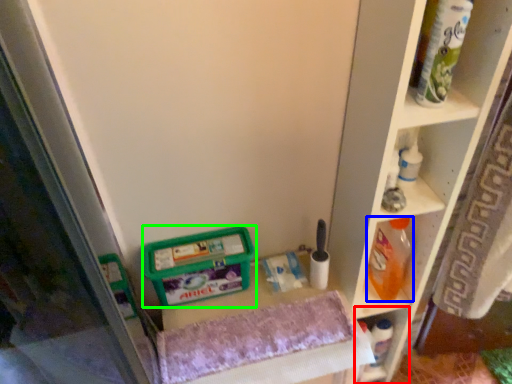
Question: Considering the real-world distances, which object is closest to shelf (highlighted by a red box)? cleaning product (highlighted by a blue box) or wide (highlighted by a green box).

Choices:
 (A) cleaning product
 (B) wide

Answer: (A)